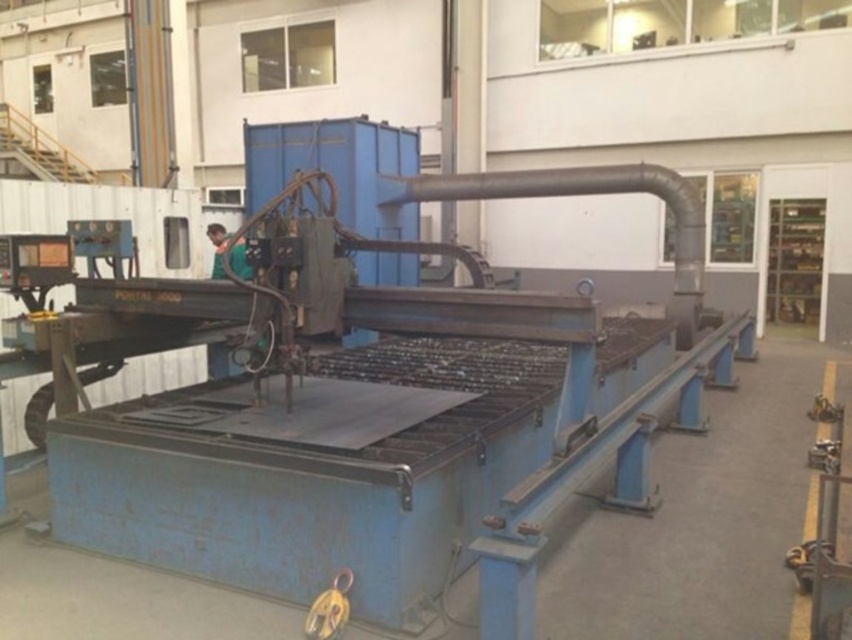
Who is lower down, yellow metallic hook at lower center or green fabric shirt at center?

yellow metallic hook at lower center is lower down.

Is point (327, 600) positioned in front of point (216, 275)?

Yes, point (327, 600) is in front of point (216, 275).

You are a GUI agent. You are given a task and a screenshot of the screen. Output one action in this format:
    pyautogui.click(x=<x>, y=<y>)
    Task: Click on the yellow metallic hook at lower center
    This screenshot has width=852, height=640.
    Given the screenshot: What is the action you would take?
    pyautogui.click(x=329, y=609)